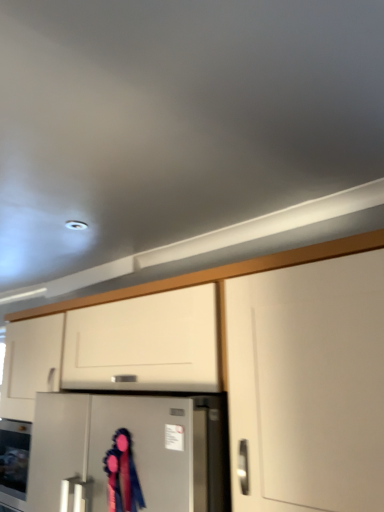
Question: Is the position of white matte cabinet at center more distant than that of satin silver refrigerator at center?

Choices:
 (A) yes
 (B) no

Answer: (B)

Question: Is white matte cabinet at center smaller than satin silver refrigerator at center?

Choices:
 (A) yes
 (B) no

Answer: (B)

Question: Considering the relative sizes of white matte cabinet at center and satin silver refrigerator at center in the image provided, is white matte cabinet at center wider than satin silver refrigerator at center?

Choices:
 (A) yes
 (B) no

Answer: (B)

Question: Could satin silver refrigerator at center be considered to be inside white matte cabinet at center?

Choices:
 (A) yes
 (B) no

Answer: (A)

Question: Is white matte cabinet at center thinner than satin silver refrigerator at center?

Choices:
 (A) no
 (B) yes

Answer: (B)

Question: From a real-world perspective, is white matte cabinet at center positioned under satin silver refrigerator at center based on gravity?

Choices:
 (A) no
 (B) yes

Answer: (A)

Question: Is satin silver refrigerator at center at the back of velvet ribbon at center?

Choices:
 (A) no
 (B) yes

Answer: (B)

Question: From a real-world perspective, does velvet ribbon at center stand above satin silver refrigerator at center?

Choices:
 (A) yes
 (B) no

Answer: (A)

Question: From the image's perspective, is velvet ribbon at center on top of satin silver refrigerator at center?

Choices:
 (A) yes
 (B) no

Answer: (A)

Question: Is velvet ribbon at center placed right next to satin silver refrigerator at center?

Choices:
 (A) no
 (B) yes

Answer: (A)

Question: Is velvet ribbon at center further to camera compared to satin silver refrigerator at center?

Choices:
 (A) yes
 (B) no

Answer: (A)

Question: Considering the relative positions of velvet ribbon at center and satin silver refrigerator at center in the image provided, is velvet ribbon at center to the right of satin silver refrigerator at center from the viewer's perspective?

Choices:
 (A) no
 (B) yes

Answer: (A)

Question: Is satin silver refrigerator at center with velvet ribbon at center?

Choices:
 (A) yes
 (B) no

Answer: (B)